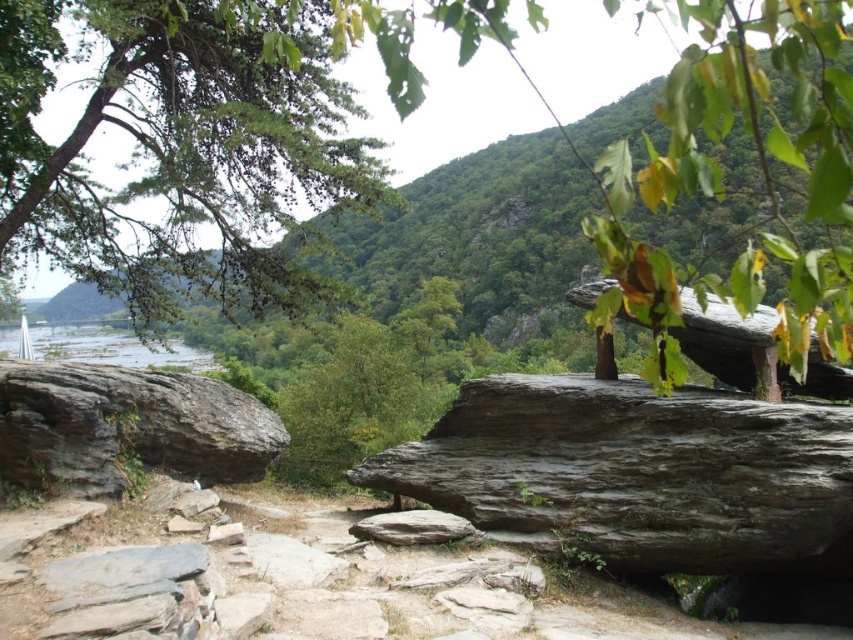
You are standing in the natural landscape and want to cross the river. You see the gray rough boulder at left and the clear blue water at upper left. Which object is closer to the riverbank where you are standing?

The gray rough boulder at left is closer to the riverbank where you are standing because it is positioned to the right of the clear blue water at upper left, which is further away.

You are standing at the point closer to the camera in the image. Which point are you at, point (718, 534) or point (105, 330)?

You are at point (718, 534) because it is closer to the camera than point (105, 330).

You are standing in the natural landscape described and want to take a photo of the green leafy tree at upper center. If your camera can focus on objects up to 40 inches away, will you be able to capture a clear image?

The green leafy tree at upper center is 39.02 inches from the viewer, which is within the camera focus range of up to 40 inches. Therefore, you can capture a clear image.